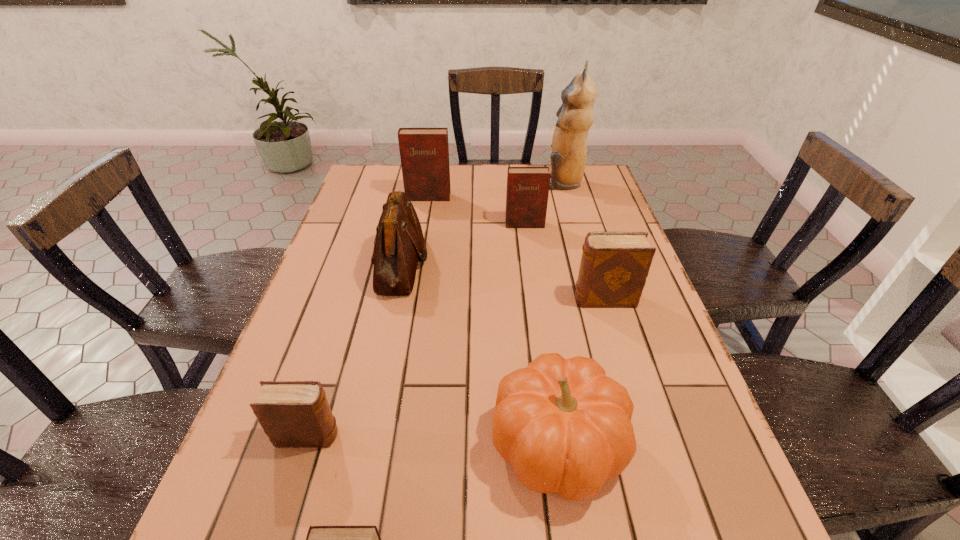
Select which object is the fourth closest to the farthest object. Please provide its 2D coordinates. Your answer should be formatted as a tuple, i.e. [(x, y)], where the tuple contains the x and y coordinates of a point satisfying the conditions above.

[(614, 266)]

Choose which object is the third nearest neighbor to the second nearest diary. Please provide its 2D coordinates. Your answer should be formatted as a tuple, i.e. [(x, y)], where the tuple contains the x and y coordinates of a point satisfying the conditions above.

[(399, 241)]

Find the location of a particular element. the third closest diary to the orange pumpkin is located at coordinates (295, 414).

This screenshot has width=960, height=540. I want to click on diary that is the fourth closest to the right brown diary, so click(x=320, y=539).

Find the location of a particular element. The image size is (960, 540). reddish-brown diary that is the second nearest to the smallest reddish-brown diary is located at coordinates (424, 152).

Find the location of `reddish-brown diary object that ranks as the second closest to the farthest reddish-brown diary`. reddish-brown diary object that ranks as the second closest to the farthest reddish-brown diary is located at coordinates (320, 539).

At what (x,y) coordinates should I click in order to perform the action: click on vacant point that satisfies the following two spatial constraints: 1. on the front cover of the tallest diary; 2. on the spine side of the left brown diary. Please return your answer as a coordinate pair (x, y). The width and height of the screenshot is (960, 540). Looking at the image, I should click on (388, 436).